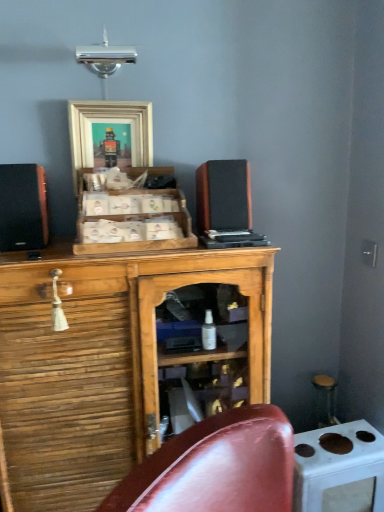
Question: Is wooden crate at center, which is counted as the second cabinetry, starting from the bottom, behind wooden speaker at center, which appears as the 1th speaker when viewed from the right?

Choices:
 (A) yes
 (B) no

Answer: (B)

Question: Can you confirm if wooden crate at center, which is counted as the second cabinetry, starting from the bottom, is smaller than wooden speaker at center, the 2th speaker viewed from the left?

Choices:
 (A) yes
 (B) no

Answer: (B)

Question: Is the surface of wooden crate at center, which appears as the first cabinetry when viewed from the top, in direct contact with wooden speaker at center, the 2th speaker viewed from the left?

Choices:
 (A) yes
 (B) no

Answer: (B)

Question: Is wooden crate at center, which appears as the first cabinetry when viewed from the top, to the right of wooden speaker at center, which appears as the 1th speaker when viewed from the right, from the viewer's perspective?

Choices:
 (A) no
 (B) yes

Answer: (A)

Question: Does wooden crate at center, which appears as the first cabinetry when viewed from the top, appear on the left side of wooden speaker at center, which appears as the 1th speaker when viewed from the right?

Choices:
 (A) yes
 (B) no

Answer: (A)

Question: In the image, is wooden speaker at center, which appears as the 1th speaker when viewed from the right, positioned in front of or behind matte black speaker at left, positioned as the first speaker in left-to-right order?

Choices:
 (A) behind
 (B) front

Answer: (A)

Question: From the image's perspective, is wooden speaker at center, which appears as the 1th speaker when viewed from the right, positioned above or below matte black speaker at left, positioned as the first speaker in left-to-right order?

Choices:
 (A) below
 (B) above

Answer: (B)

Question: From a real-world perspective, is wooden speaker at center, the 2th speaker viewed from the left, positioned above or below matte black speaker at left, positioned as the first speaker in left-to-right order?

Choices:
 (A) below
 (B) above

Answer: (B)

Question: Is wooden speaker at center, the 2th speaker viewed from the left, wider or thinner than matte black speaker at left, positioned as the first speaker in left-to-right order?

Choices:
 (A) wide
 (B) thin

Answer: (B)

Question: From a real-world perspective, is matte black speaker at left, which ranks as the second speaker in right-to-left order, physically located above or below white glossy stove at lower right?

Choices:
 (A) above
 (B) below

Answer: (A)

Question: Is matte black speaker at left, which ranks as the second speaker in right-to-left order, spatially inside white glossy stove at lower right, or outside of it?

Choices:
 (A) inside
 (B) outside

Answer: (B)

Question: Relative to white glossy stove at lower right, is matte black speaker at left, which ranks as the second speaker in right-to-left order, in front or behind?

Choices:
 (A) front
 (B) behind

Answer: (A)

Question: Is point (23, 236) positioned closer to the camera than point (292, 505)?

Choices:
 (A) closer
 (B) farther

Answer: (A)

Question: Is point (208, 162) closer or farther from the camera than point (115, 115)?

Choices:
 (A) farther
 (B) closer

Answer: (A)

Question: From a real-world perspective, relative to wooden framed picture at upper center, is wooden speaker at center, which appears as the 1th speaker when viewed from the right, vertically above or below?

Choices:
 (A) below
 (B) above

Answer: (A)